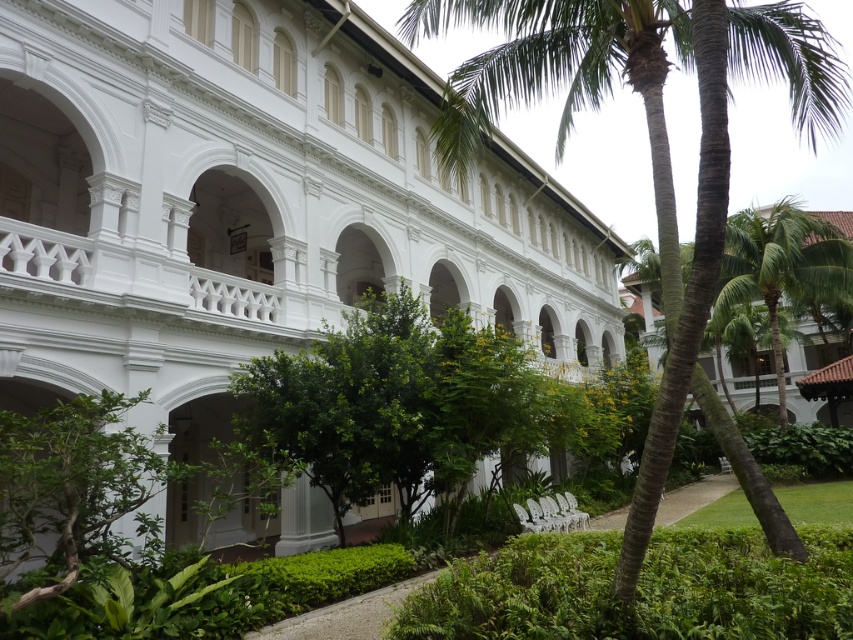
In the scene shown: Can you confirm if white smooth building at center is thinner than green textured palm tree at center?

Yes, white smooth building at center is thinner than green textured palm tree at center.

Is point (126, 13) more distant than point (701, 292)?

Yes, point (126, 13) is farther from viewer.

Where is `white smooth building at center`? This screenshot has height=640, width=853. white smooth building at center is located at coordinates (251, 204).